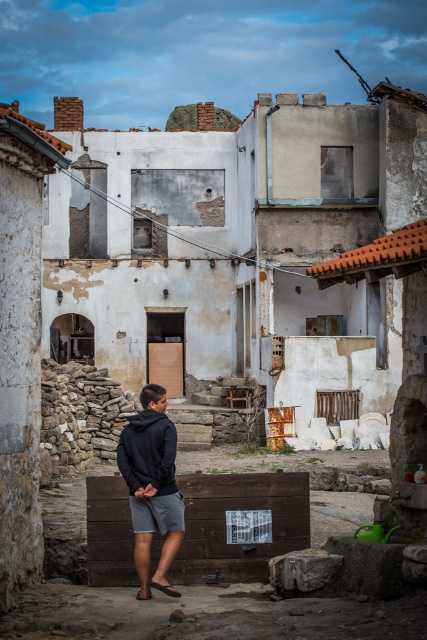
Can you confirm if dark gray hoodie at center is thinner than black leather sandal at lower center?

Incorrect, dark gray hoodie at center's width is not less than black leather sandal at lower center's.

Is dark gray hoodie at center above black leather sandal at lower center?

Yes, dark gray hoodie at center is above black leather sandal at lower center.

Which is in front, point (166, 486) or point (158, 586)?

Positioned in front is point (158, 586).

Find the location of a particular element. dark gray hoodie at center is located at coordinates (152, 483).

Is black fleece sweatshirt at center smaller than black rubber sandal at lower center?

Incorrect, black fleece sweatshirt at center is not smaller in size than black rubber sandal at lower center.

Can you confirm if black fleece sweatshirt at center is positioned above black rubber sandal at lower center?

Yes, black fleece sweatshirt at center is above black rubber sandal at lower center.

Which is in front, point (131, 486) or point (139, 596)?

Point (139, 596)

This screenshot has width=427, height=640. Find the location of `black fleece sweatshirt at center`. black fleece sweatshirt at center is located at coordinates (148, 452).

Between point (122, 472) and point (151, 593), which one is positioned in front?

Point (151, 593) is more forward.

Between dark gray hoodie at center and black rubber sandal at lower center, which one is positioned lower?

black rubber sandal at lower center is below.

Which is in front, point (137, 564) or point (146, 596)?

Point (137, 564)

I want to click on dark gray hoodie at center, so click(152, 483).